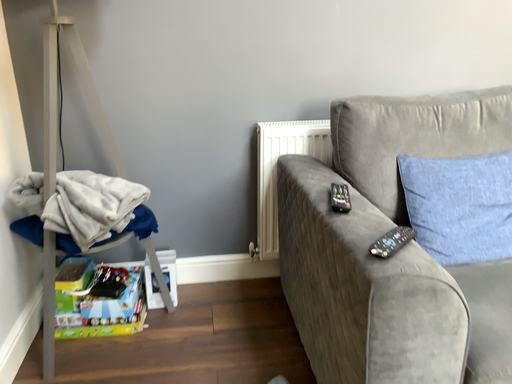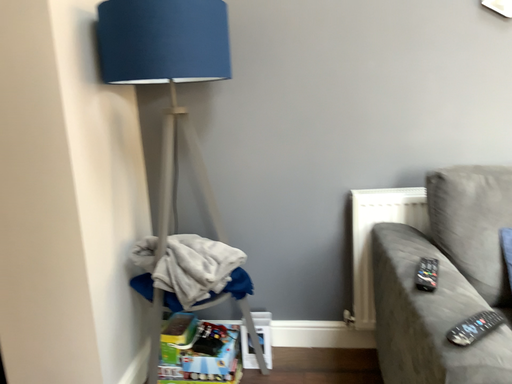
Question: How did the camera likely rotate when shooting the video?

Choices:
 (A) rotated downward
 (B) rotated upward

Answer: (B)